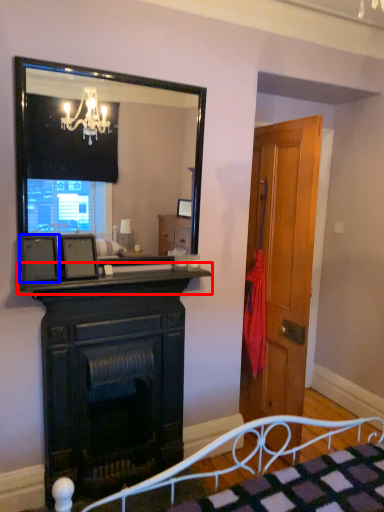
Question: Which of the following is the farthest to the observer, mantle (highlighted by a red box) or picture frame (highlighted by a blue box)?

Choices:
 (A) mantle
 (B) picture frame

Answer: (B)